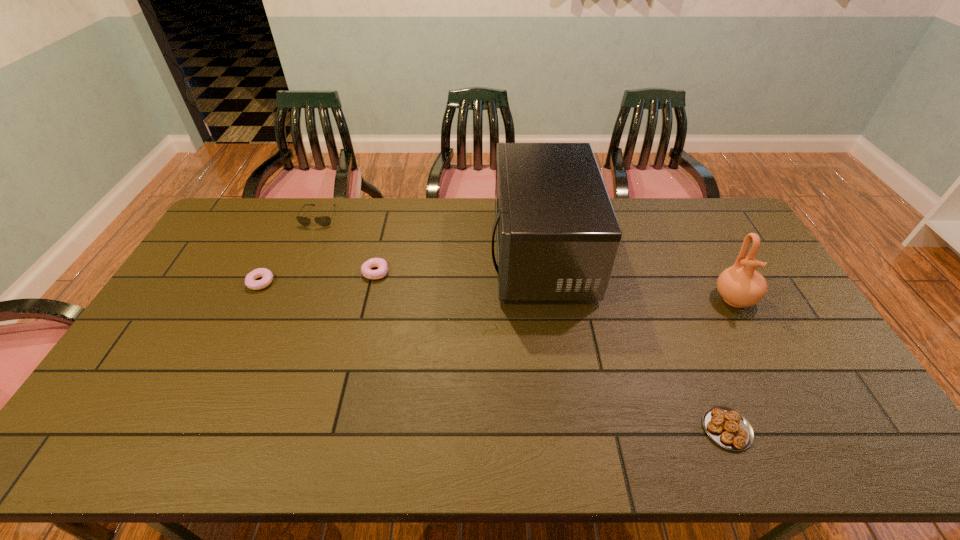
I want to click on free space that is in between the pottery and the microwave oven, so click(x=637, y=275).

In order to click on blank region between the left doughnut and the rightmost object in this screenshot , I will do `click(497, 291)`.

At what (x,y) coordinates should I click in order to perform the action: click on unoccupied area between the rightmost object and the tallest object. Please return your answer as a coordinate pair (x, y). This screenshot has height=540, width=960. Looking at the image, I should click on (637, 275).

The image size is (960, 540). I want to click on free space between the pottery and the second object from right to left, so click(731, 363).

You are a GUI agent. You are given a task and a screenshot of the screen. Output one action in this format:
    pyautogui.click(x=<x>, y=<y>)
    Task: Click on the empty space between the tallest object and the sunglasses
    The width and height of the screenshot is (960, 540).
    Given the screenshot: What is the action you would take?
    pyautogui.click(x=430, y=234)

Identify which object is the fourth closest to the fifth shortest object. Please provide its 2D coordinates. Your answer should be formatted as a tuple, i.e. [(x, y)], where the tuple contains the x and y coordinates of a point satisfying the conditions above.

[(324, 221)]

Locate which object ranks in proximity to the second object from right to left. Please provide its 2D coordinates. Your answer should be formatted as a tuple, i.e. [(x, y)], where the tuple contains the x and y coordinates of a point satisfying the conditions above.

[(740, 285)]

The image size is (960, 540). I want to click on vacant position in the image that satisfies the following two spatial constraints: 1. on the front-facing side of the sunglasses; 2. on the left side of the right doughnut, so (x=297, y=273).

The width and height of the screenshot is (960, 540). Identify the location of free point that satisfies the following two spatial constraints: 1. on the front side of the fourth object from right to left; 2. on the left side of the pastry. (338, 429).

You are a GUI agent. You are given a task and a screenshot of the screen. Output one action in this format:
    pyautogui.click(x=<x>, y=<y>)
    Task: Click on the free space that satisfies the following two spatial constraints: 1. on the front-facing side of the fourth shortest object; 2. on the left side of the pastry
    This screenshot has width=960, height=540.
    Given the screenshot: What is the action you would take?
    pyautogui.click(x=230, y=429)